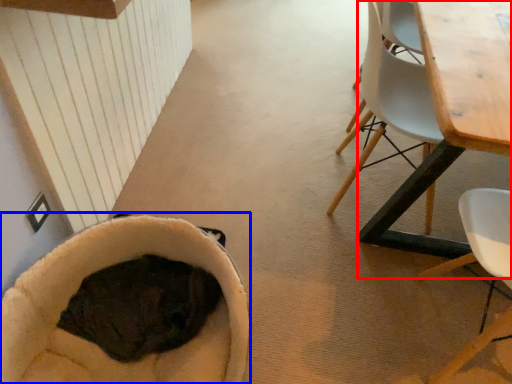
Question: Which object is further to the camera taking this photo, table (highlighted by a red box) or bean bag chair (highlighted by a blue box)?

Choices:
 (A) table
 (B) bean bag chair

Answer: (B)